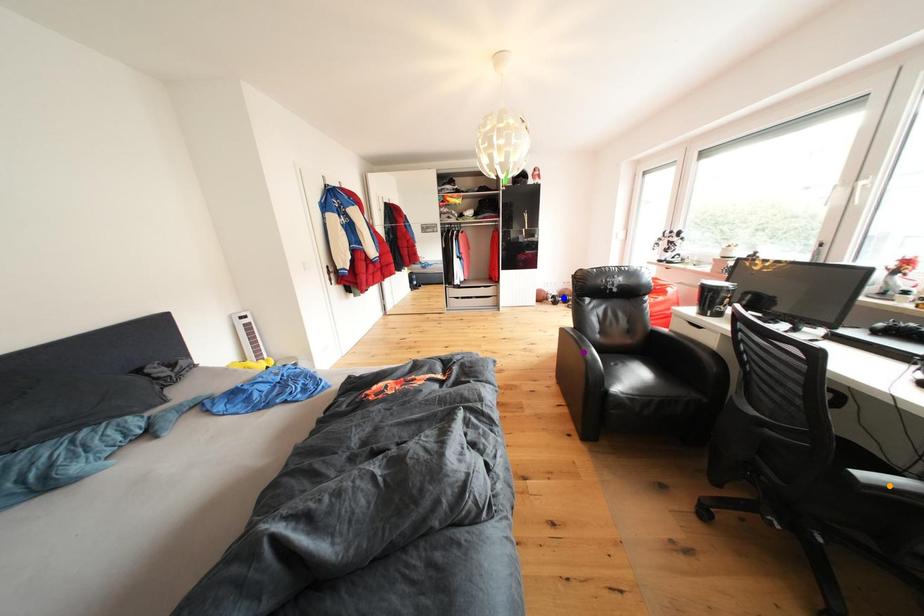
Consider the image. Order these from nearest to farthest:
1. orange point
2. blue point
3. purple point

1. orange point
2. purple point
3. blue point